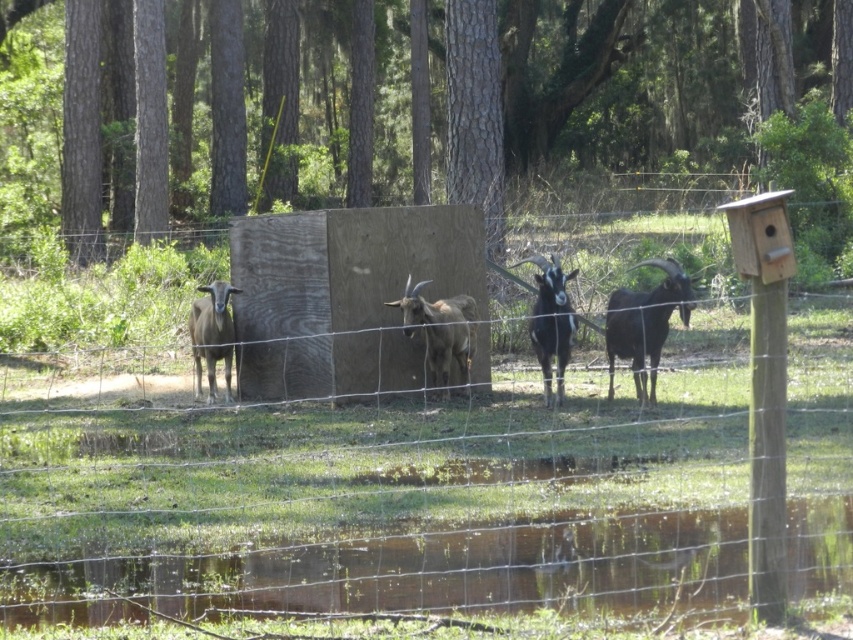
You are a farmer checking on your goats in the fenced enclosure. You notice the brown woolen goats at center and the black woolly goat at right. Which group of goats is positioned lower in the enclosure?

The brown woolen goats at center are positioned lower than the black woolly goat at right in the enclosure.

You are standing at the origin point in the image and want to reach the point at the bottom of the enclosure fence. Which point, point at (462, 369) or point at (648, 355), is closer to you?

Point at (648, 355) is closer to you since it is in front of point at (462, 369), which is behind it.